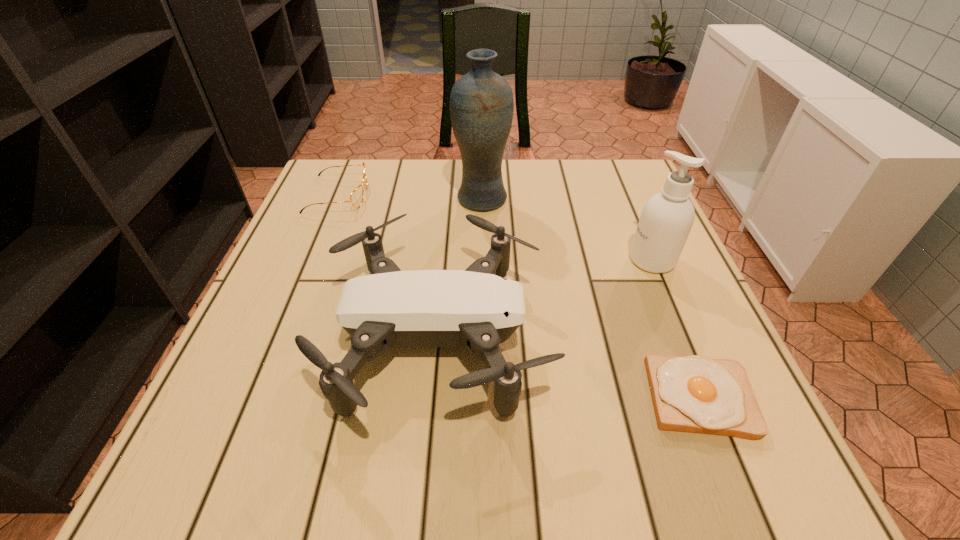
Find the location of a particular element. The height and width of the screenshot is (540, 960). vacant area that satisfies the following two spatial constraints: 1. on the front label of the second tallest object; 2. on the front side of the shortest object is located at coordinates (710, 397).

Locate an element on the screen. The image size is (960, 540). free space that satisfies the following two spatial constraints: 1. on the camera side of the third tallest object; 2. on the back side of the toast is located at coordinates (433, 397).